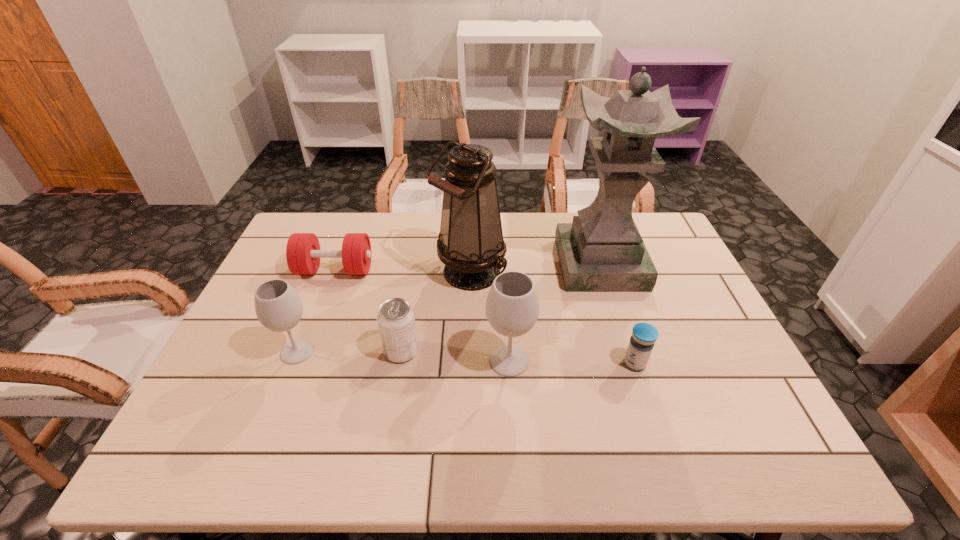
At what (x,y) coordinates should I click in order to perform the action: click on vacant point located 0.310m on the back of the left wineglass. Please return your answer as a coordinate pair (x, y). Looking at the image, I should click on (333, 262).

You are a GUI agent. You are given a task and a screenshot of the screen. Output one action in this format:
    pyautogui.click(x=<x>, y=<y>)
    Task: Click on the free space located 0.240m on the back of the taller wineglass
    The width and height of the screenshot is (960, 540).
    Given the screenshot: What is the action you would take?
    pyautogui.click(x=504, y=281)

The width and height of the screenshot is (960, 540). What are the coordinates of `free location located 0.100m on the back of the dumbbell` in the screenshot? It's located at (347, 239).

Where is `vacant space located at the front opening of the tallest object`? The image size is (960, 540). vacant space located at the front opening of the tallest object is located at coordinates click(618, 320).

The height and width of the screenshot is (540, 960). Identify the location of free point located 0.340m on the front of the oil lamp. tap(467, 400).

Where is `free space located on the right of the soda can`? free space located on the right of the soda can is located at coordinates (498, 351).

The image size is (960, 540). I want to click on free space located 0.120m on the right of the medicine, so click(695, 363).

The width and height of the screenshot is (960, 540). I want to click on sculpture that is at the far edge, so click(602, 250).

Image resolution: width=960 pixels, height=540 pixels. What are the coordinates of `oil lamp that is positioned at the far edge` in the screenshot? It's located at (470, 243).

This screenshot has width=960, height=540. Find the location of `wineglass present at the left edge`. wineglass present at the left edge is located at coordinates (278, 307).